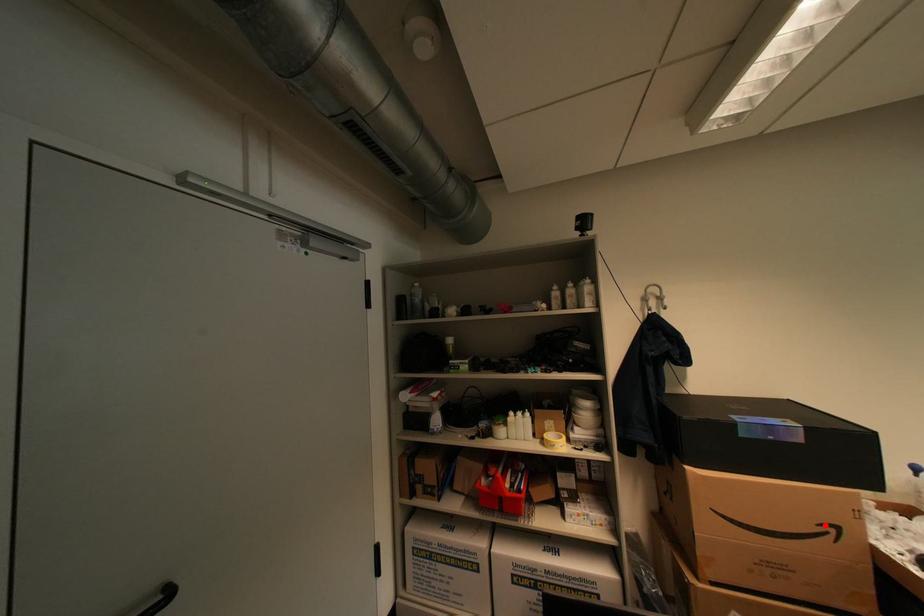
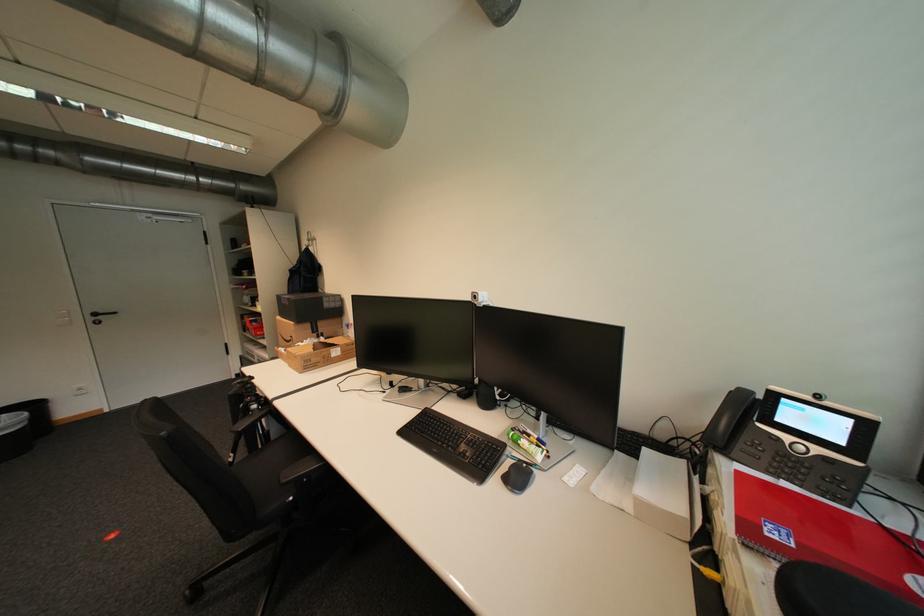
Question: I am providing you with two images of the same scene from different viewpoints. Given a red point in image1, look at the same physical point in image2. Is it:

Choices:
 (A) Closer to the viewpoint
 (B) Farther from the viewpoint

Answer: (B)